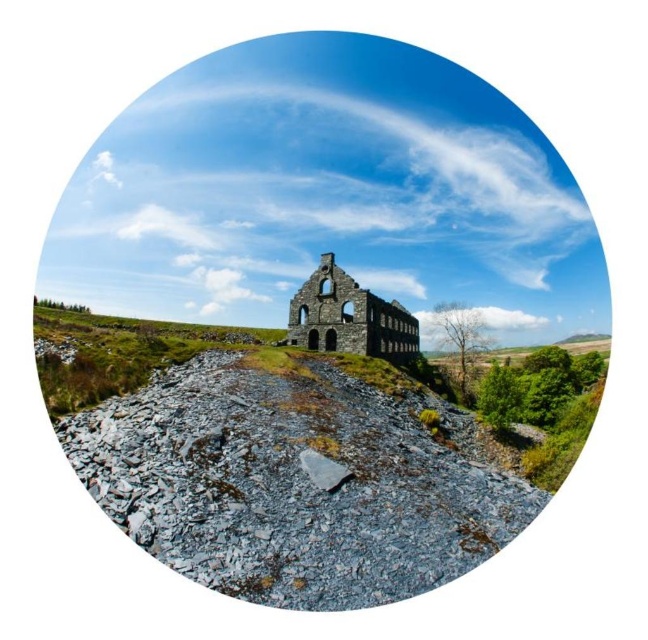
Question: Which object is positioned farthest from the brown stone church at center?

Choices:
 (A) gray rock at center
 (B) gray rough stone at lower center

Answer: (B)

Question: Which point appears closest to the camera in this image?

Choices:
 (A) (332, 468)
 (B) (345, 310)

Answer: (A)

Question: Is brown stone church at center wider than gray rough stone at lower center?

Choices:
 (A) no
 (B) yes

Answer: (B)

Question: Which object appears closest to the camera in this image?

Choices:
 (A) brown stone church at center
 (B) gray rock at center
 (C) gray rough stone at lower center

Answer: (B)

Question: Can you confirm if gray rock at center is positioned below gray rough stone at lower center?

Choices:
 (A) yes
 (B) no

Answer: (A)

Question: Does gray rock at center have a larger size compared to gray rough stone at lower center?

Choices:
 (A) no
 (B) yes

Answer: (B)